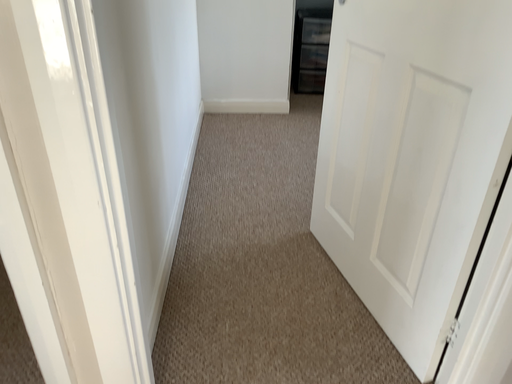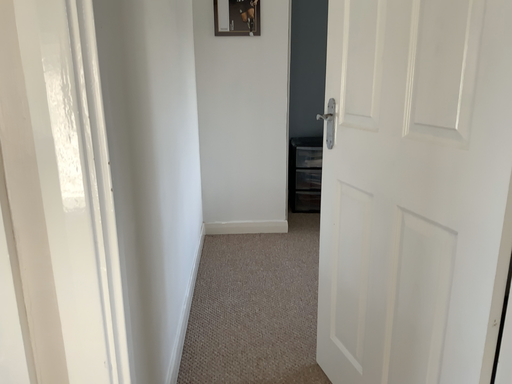
Question: Which way did the camera rotate in the video?

Choices:
 (A) rotated downward
 (B) rotated upward

Answer: (B)